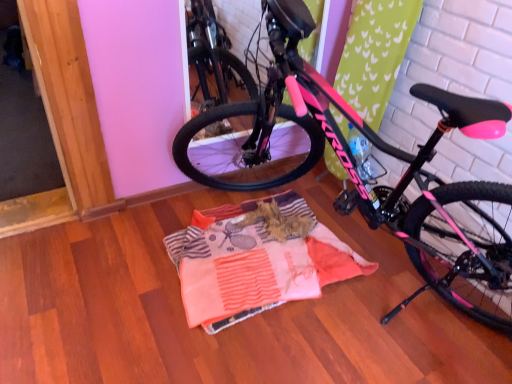
This screenshot has width=512, height=384. What are the coordinates of `free space in front of striped cotton blanket at center` in the screenshot? It's located at (256, 346).